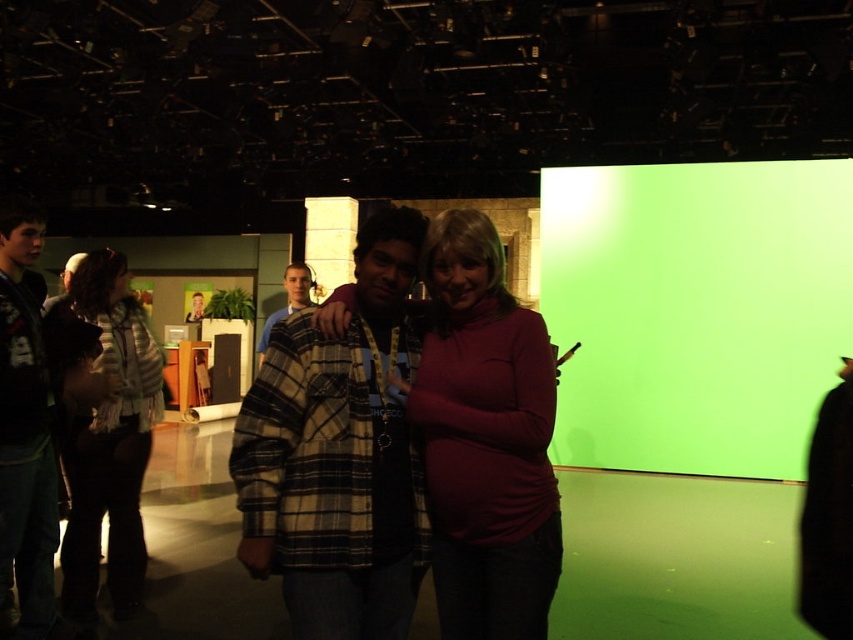
You are a camera operator holding a camera that requires a minimum of 1.5 meters of distance to avoid blurring the subject. You need to capture a clear shot of the matte red sweater at center. Is the current distance sufficient?

The matte red sweater at center and camera are 1.65 meters apart, which is more than the required 1.5 meters. Therefore, the distance is sufficient to avoid blurring and capture a clear shot.

You are a photographer setting up for a photoshoot in the studio. You need to adjust the lighting so that both the dark green plaid shirt at left and the plaid wool sweater at center are evenly lit. Based on their positions, which object is closer to the main light source?

The plaid wool sweater at center is closer to the main light source because it is positioned above the dark green plaid shirt at left, which is located below it.